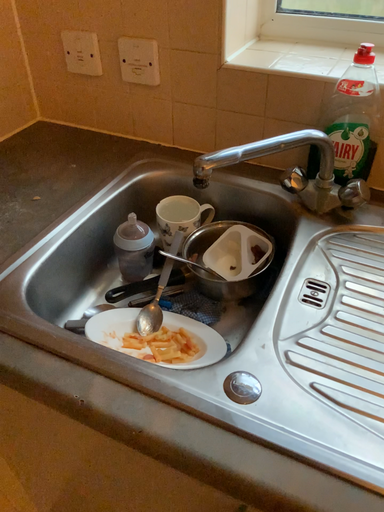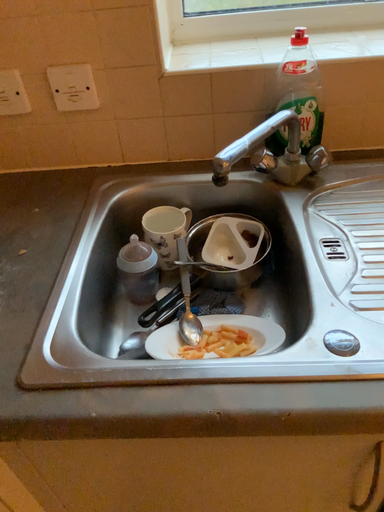
Question: How did the camera likely rotate when shooting the video?

Choices:
 (A) rotated right
 (B) rotated left

Answer: (A)